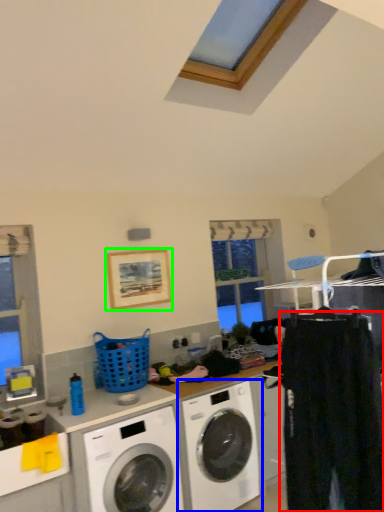
Question: Considering the real-world distances, which object is farthest from clothing (highlighted by a red box)? washing machine (highlighted by a blue box) or picture frame (highlighted by a green box)?

Choices:
 (A) washing machine
 (B) picture frame

Answer: (B)